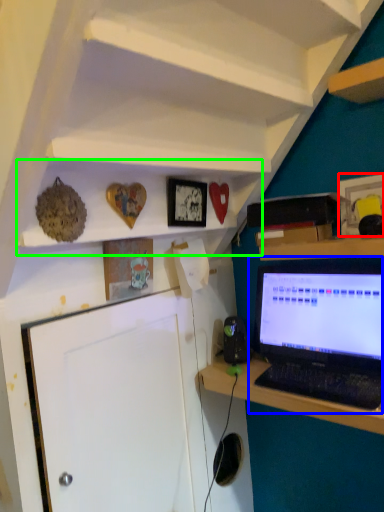
Question: Which is nearer to the picture frame (highlighted by a red box)? laptop (highlighted by a blue box) or shelf (highlighted by a green box).

Choices:
 (A) laptop
 (B) shelf

Answer: (A)